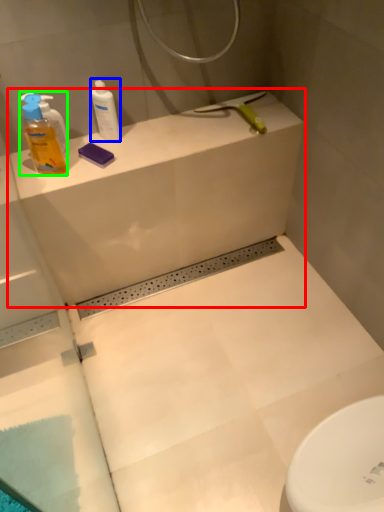
Question: Based on their relative distances, which object is nearer to counter top (highlighted by a red box)? Choose from cleaning product (highlighted by a blue box) and cleaning product (highlighted by a green box).

Choices:
 (A) cleaning product
 (B) cleaning product

Answer: (A)